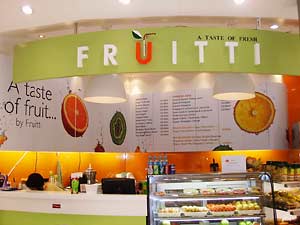
Locate an element on the screen. display is located at coordinates (198, 195).